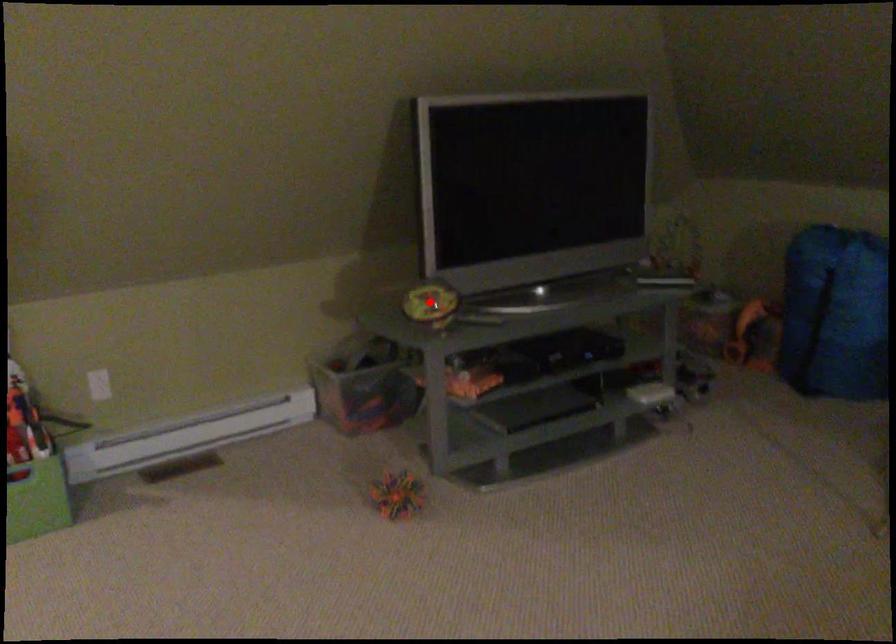
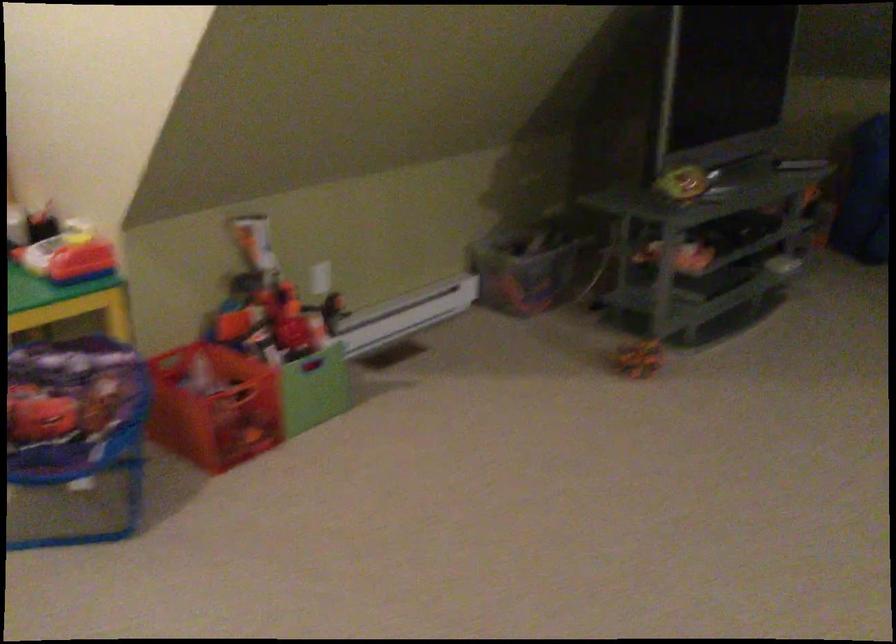
Question: I am providing you with two images of the same scene from different viewpoints. A red point is marked on the first image. At the location where the point appears in image 1, is it still visible in image 2?

Choices:
 (A) Yes
 (B) No

Answer: (B)